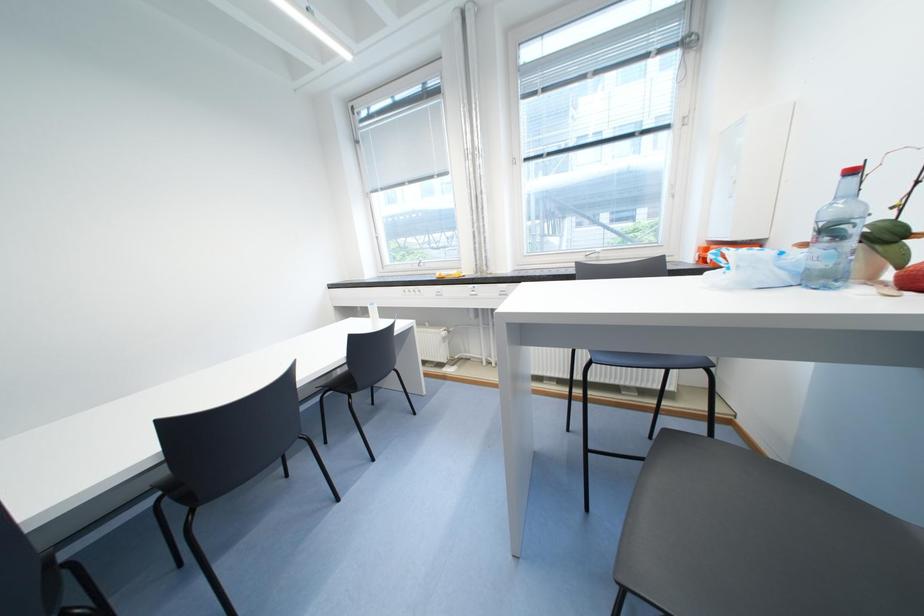
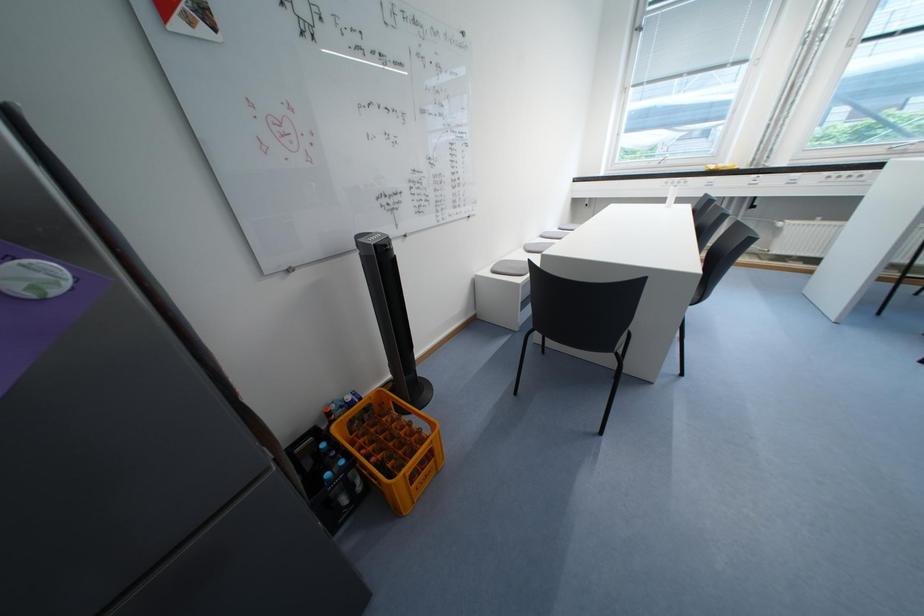
In a continuous first-person perspective shot, in which direction is the camera moving?

The movement direction of the cameraman is left, backward.